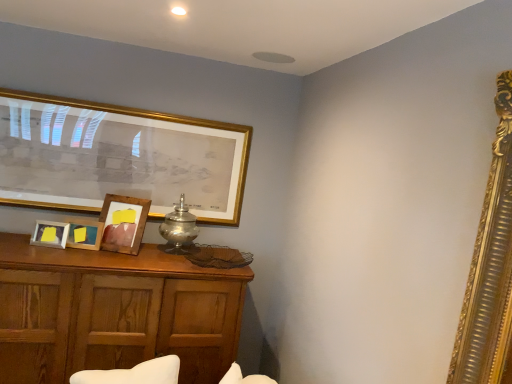
Question: Is silver metallic table lamp at center at the left side of gold-framed picture at upper left, the fourth picture frame viewed from the front?

Choices:
 (A) yes
 (B) no

Answer: (B)

Question: From a real-world perspective, is silver metallic table lamp at center over gold-framed picture at upper left, the first picture frame from the back?

Choices:
 (A) yes
 (B) no

Answer: (B)

Question: Considering the relative sizes of silver metallic table lamp at center and gold-framed picture at upper left, the fourth picture frame viewed from the front, in the image provided, is silver metallic table lamp at center bigger than gold-framed picture at upper left, the fourth picture frame viewed from the front,?

Choices:
 (A) yes
 (B) no

Answer: (B)

Question: Could you tell me if silver metallic table lamp at center is turned towards gold-framed picture at upper left, the fourth picture frame viewed from the front?

Choices:
 (A) yes
 (B) no

Answer: (B)

Question: Considering the relative sizes of silver metallic table lamp at center and gold-framed picture at upper left, the first picture frame from the back, in the image provided, is silver metallic table lamp at center taller than gold-framed picture at upper left, the first picture frame from the back,?

Choices:
 (A) no
 (B) yes

Answer: (A)

Question: Is the position of silver metallic table lamp at center more distant than that of gold-framed picture at upper left, the fourth picture frame viewed from the front?

Choices:
 (A) no
 (B) yes

Answer: (B)

Question: Can you confirm if wooden photo frame at lower left, placed as the 4th picture frame when sorted from back to front, is bigger than wooden cabinet at lower left?

Choices:
 (A) no
 (B) yes

Answer: (A)

Question: Can you confirm if wooden photo frame at lower left, which appears as the 1th picture frame when viewed from the front, is shorter than wooden cabinet at lower left?

Choices:
 (A) no
 (B) yes

Answer: (B)

Question: From the image's perspective, does wooden photo frame at lower left, placed as the 4th picture frame when sorted from back to front, appear higher than wooden cabinet at lower left?

Choices:
 (A) no
 (B) yes

Answer: (B)

Question: Considering the relative positions of wooden photo frame at lower left, placed as the 4th picture frame when sorted from back to front, and wooden cabinet at lower left in the image provided, is wooden photo frame at lower left, placed as the 4th picture frame when sorted from back to front, to the left of wooden cabinet at lower left from the viewer's perspective?

Choices:
 (A) no
 (B) yes

Answer: (B)

Question: Is there a large distance between wooden photo frame at lower left, placed as the 4th picture frame when sorted from back to front, and wooden cabinet at lower left?

Choices:
 (A) yes
 (B) no

Answer: (B)

Question: From a real-world perspective, does wooden photo frame at lower left, placed as the 4th picture frame when sorted from back to front, stand above wooden cabinet at lower left?

Choices:
 (A) no
 (B) yes

Answer: (B)

Question: From a real-world perspective, does silver metallic table lamp at center stand above wooden picture frame at center, the 2th picture frame viewed from the front?

Choices:
 (A) yes
 (B) no

Answer: (A)